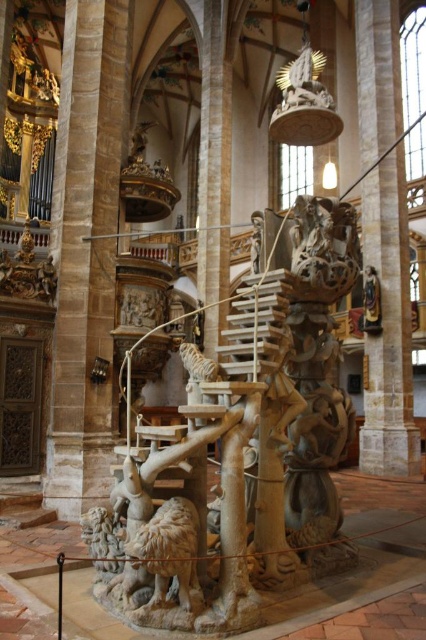
You are an art conservator standing in the cathedral and need to move a protective barrier from the smooth stone pillar at right to the carved stone sculpture at center. Which direction should you move the barrier?

You should move the barrier to the left, as the carved stone sculpture at center is located to the left of the smooth stone pillar at right.

You are standing in the cathedral and want to take a photo of the carved stone sculpture at center. If you are positioned at point A, which is at coordinates 0.5, 0.5, in which direction should you move to get a better view of the sculpture?

The carved stone sculpture at center is located at point (247, 444). Since you are at point (213, 320), you should move northeast to get a better view of the sculpture.